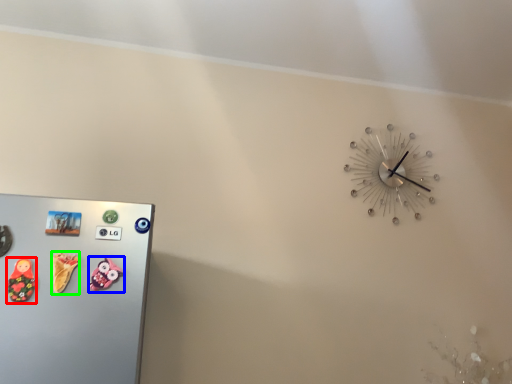
Question: Based on their relative distances, which object is farther from toy (highlighted by a red box)? Choose from toy (highlighted by a blue box) and toy (highlighted by a green box).

Choices:
 (A) toy
 (B) toy

Answer: (A)